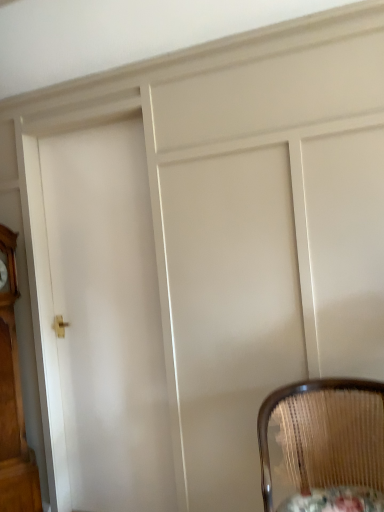
Question: Considering the relative sizes of wooden grandfather clock at left and wooden textured round table at lower right in the image provided, is wooden grandfather clock at left taller than wooden textured round table at lower right?

Choices:
 (A) no
 (B) yes

Answer: (B)

Question: Is wooden grandfather clock at left to the right of wooden textured round table at lower right from the viewer's perspective?

Choices:
 (A) yes
 (B) no

Answer: (B)

Question: From a real-world perspective, does wooden grandfather clock at left stand above wooden textured round table at lower right?

Choices:
 (A) no
 (B) yes

Answer: (B)

Question: Is wooden textured round table at lower right at the back of wooden grandfather clock at left?

Choices:
 (A) no
 (B) yes

Answer: (A)

Question: Considering the relative positions of wooden grandfather clock at left and wooden textured round table at lower right in the image provided, is wooden grandfather clock at left to the left of wooden textured round table at lower right from the viewer's perspective?

Choices:
 (A) yes
 (B) no

Answer: (A)

Question: Would you say white glossy door at center is inside or outside wooden textured round table at lower right?

Choices:
 (A) outside
 (B) inside

Answer: (A)

Question: Visually, is white glossy door at center positioned to the left or to the right of wooden textured round table at lower right?

Choices:
 (A) left
 (B) right

Answer: (A)

Question: Based on their sizes in the image, would you say white glossy door at center is bigger or smaller than wooden textured round table at lower right?

Choices:
 (A) big
 (B) small

Answer: (A)

Question: From the image's perspective, is white glossy door at center positioned above or below wooden textured round table at lower right?

Choices:
 (A) above
 (B) below

Answer: (A)

Question: From the image's perspective, is woven wood chair at lower right above or below wooden textured round table at lower right?

Choices:
 (A) below
 (B) above

Answer: (B)

Question: In the image, is woven wood chair at lower right positioned in front of or behind wooden textured round table at lower right?

Choices:
 (A) behind
 (B) front

Answer: (B)

Question: Does point (322, 415) appear closer or farther from the camera than point (340, 509)?

Choices:
 (A) closer
 (B) farther

Answer: (B)

Question: From a real-world perspective, is woven wood chair at lower right positioned above or below wooden textured round table at lower right?

Choices:
 (A) above
 (B) below

Answer: (A)

Question: From the image's perspective, is wooden textured round table at lower right positioned above or below wooden grandfather clock at left?

Choices:
 (A) below
 (B) above

Answer: (A)

Question: From a real-world perspective, is wooden textured round table at lower right physically located above or below wooden grandfather clock at left?

Choices:
 (A) below
 (B) above

Answer: (A)